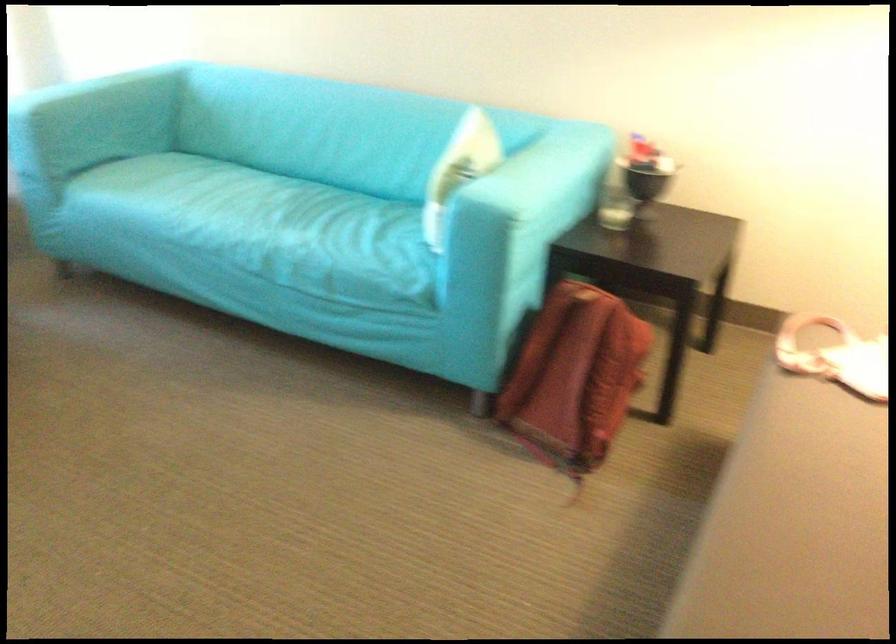
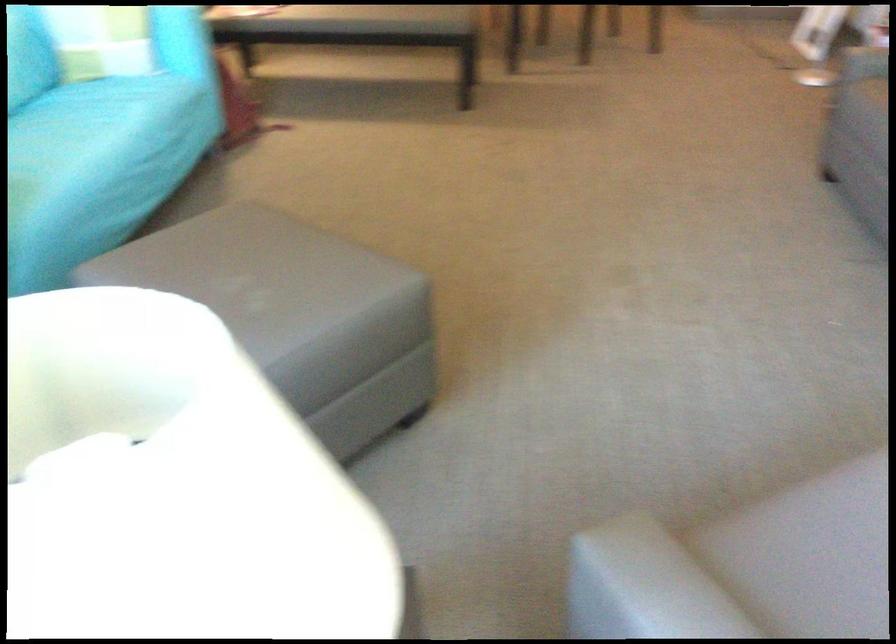
Where in the second image is the point corresponding to point 213,207 from the first image?

(87, 134)